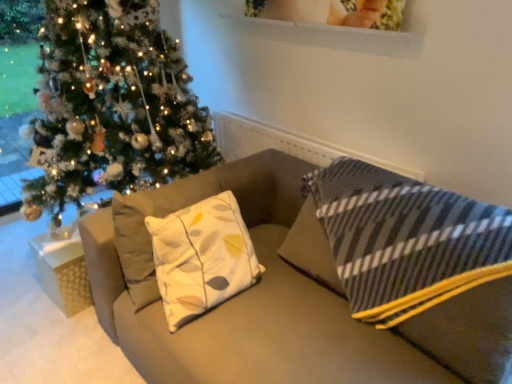
Question: Is shiny green christmas tree at left shorter than matte beige couch at center?

Choices:
 (A) yes
 (B) no

Answer: (B)

Question: Is shiny green christmas tree at left smaller than matte beige couch at center?

Choices:
 (A) no
 (B) yes

Answer: (A)

Question: Can you confirm if shiny green christmas tree at left is wider than matte beige couch at center?

Choices:
 (A) no
 (B) yes

Answer: (B)

Question: Would you say shiny green christmas tree at left is a long distance from matte beige couch at center?

Choices:
 (A) yes
 (B) no

Answer: (B)

Question: From a real-world perspective, is shiny green christmas tree at left over matte beige couch at center?

Choices:
 (A) yes
 (B) no

Answer: (A)

Question: Considering their positions, is matte beige couch at center located in front of or behind white textured gift box at lower left?

Choices:
 (A) front
 (B) behind

Answer: (A)

Question: Based on their positions, is matte beige couch at center located to the left or right of white textured gift box at lower left?

Choices:
 (A) left
 (B) right

Answer: (B)

Question: Choose the correct answer: Is matte beige couch at center inside white textured gift box at lower left or outside it?

Choices:
 (A) inside
 (B) outside

Answer: (B)

Question: From a real-world perspective, is matte beige couch at center physically located above or below white textured gift box at lower left?

Choices:
 (A) below
 (B) above

Answer: (B)

Question: Visually, is shiny green christmas tree at left positioned to the left or to the right of white textured gift box at lower left?

Choices:
 (A) right
 (B) left

Answer: (A)

Question: From the image's perspective, is shiny green christmas tree at left positioned above or below white textured gift box at lower left?

Choices:
 (A) above
 (B) below

Answer: (A)

Question: Is point (41, 178) closer or farther from the camera than point (73, 283)?

Choices:
 (A) closer
 (B) farther

Answer: (B)

Question: Considering the positions of shiny green christmas tree at left and white textured gift box at lower left in the image, is shiny green christmas tree at left taller or shorter than white textured gift box at lower left?

Choices:
 (A) short
 (B) tall

Answer: (B)

Question: Looking at the image, does shiny green christmas tree at left seem bigger or smaller compared to matte beige couch at center?

Choices:
 (A) small
 (B) big

Answer: (B)

Question: From a real-world perspective, is shiny green christmas tree at left above or below matte beige couch at center?

Choices:
 (A) below
 (B) above

Answer: (B)